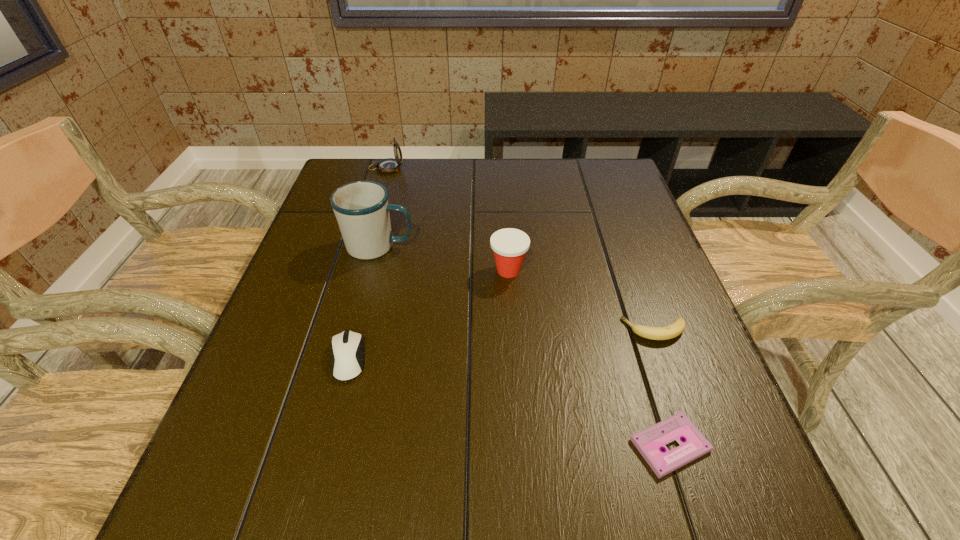
Locate an element on the screen. the tallest object is located at coordinates (361, 208).

This screenshot has width=960, height=540. Find the location of `compass`. compass is located at coordinates (390, 165).

I want to click on Dixie cup, so [x=509, y=245].

This screenshot has height=540, width=960. In order to click on mouse in this screenshot , I will do `click(347, 348)`.

The width and height of the screenshot is (960, 540). I want to click on banana, so click(673, 330).

What are the coordinates of `the shortest object` in the screenshot? It's located at point(649,442).

Locate an element on the screen. Image resolution: width=960 pixels, height=540 pixels. videotape is located at coordinates (649, 442).

Identify the location of vacant space located 0.210m on the handle side of the tallest object. (500, 246).

At what (x,y) coordinates should I click in order to perform the action: click on free space located on the face of the farthest object. Please return your answer as a coordinate pair (x, y). Looking at the image, I should click on (485, 168).

In order to click on vacant space located 0.280m on the right of the third object from right to left in this screenshot , I will do `click(648, 271)`.